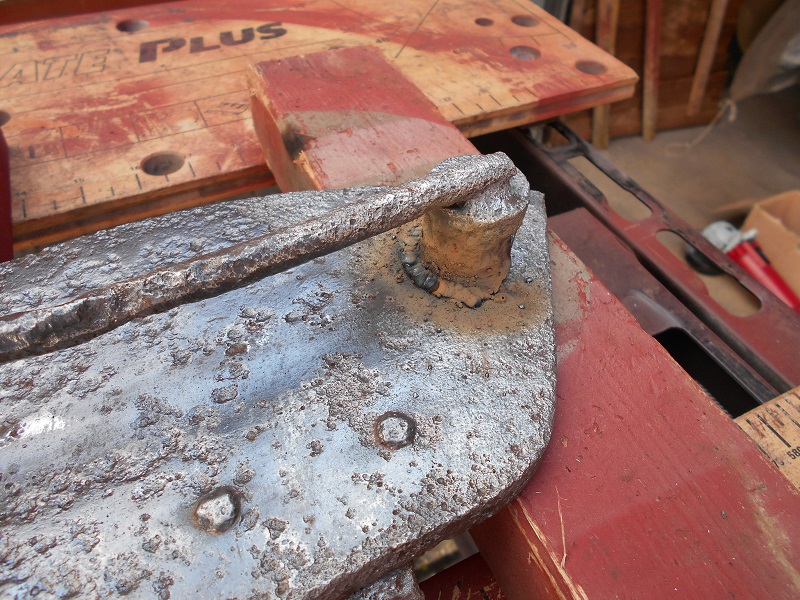
Where is `bracket`? The width and height of the screenshot is (800, 600). bracket is located at coordinates (638, 226).